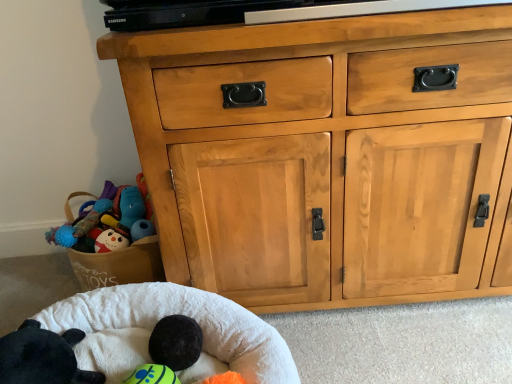
Question: From the image's perspective, is white soft infant bed at lower left on top of black plush toy at lower left?

Choices:
 (A) yes
 (B) no

Answer: (B)

Question: Considering the relative sizes of white soft infant bed at lower left and black plush toy at lower left in the image provided, is white soft infant bed at lower left wider than black plush toy at lower left?

Choices:
 (A) no
 (B) yes

Answer: (B)

Question: Can you confirm if white soft infant bed at lower left is thinner than black plush toy at lower left?

Choices:
 (A) no
 (B) yes

Answer: (A)

Question: Is white soft infant bed at lower left taller than black plush toy at lower left?

Choices:
 (A) yes
 (B) no

Answer: (A)

Question: From the image's perspective, is white soft infant bed at lower left located beneath black plush toy at lower left?

Choices:
 (A) yes
 (B) no

Answer: (A)

Question: In the image, is white soft infant bed at lower left positioned in front of or behind black plush toy at lower left?

Choices:
 (A) behind
 (B) front

Answer: (B)

Question: Based on their positions, is white soft infant bed at lower left located to the left or right of black plush toy at lower left?

Choices:
 (A) right
 (B) left

Answer: (A)

Question: Is point (61, 322) positioned closer to the camera than point (67, 344)?

Choices:
 (A) farther
 (B) closer

Answer: (A)

Question: Looking at their shapes, would you say white soft infant bed at lower left is wider or thinner than black plush toy at lower left?

Choices:
 (A) wide
 (B) thin

Answer: (A)

Question: Is white soft infant bed at lower left inside or outside of natural wood cabinet at center?

Choices:
 (A) inside
 (B) outside

Answer: (B)

Question: From the image's perspective, is white soft infant bed at lower left above or below natural wood cabinet at center?

Choices:
 (A) above
 (B) below

Answer: (B)

Question: Considering the positions of white soft infant bed at lower left and natural wood cabinet at center in the image, is white soft infant bed at lower left taller or shorter than natural wood cabinet at center?

Choices:
 (A) short
 (B) tall

Answer: (A)

Question: From a real-world perspective, relative to natural wood cabinet at center, is white soft infant bed at lower left vertically above or below?

Choices:
 (A) above
 (B) below

Answer: (B)

Question: Would you say black plush toy at lower left is inside or outside natural wood cabinet at center?

Choices:
 (A) inside
 (B) outside

Answer: (B)

Question: Considering the relative positions of black plush toy at lower left and natural wood cabinet at center in the image provided, is black plush toy at lower left to the left or to the right of natural wood cabinet at center?

Choices:
 (A) left
 (B) right

Answer: (A)